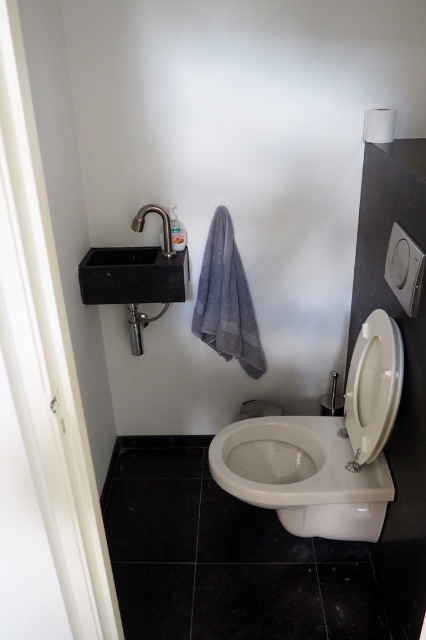
You are a bathroom designer planning to install a new 24 inch wide decorative shelf between the white glossy toilet at center and the gray matte towel bar at upper center. Based on the current spacing between them, will the shelf fit without moving either object?

The distance between the white glossy toilet at center and the gray matte towel bar at upper center is 38.46 inches. Since the shelf is only 24 inches wide, there is enough space to install it without moving either object.

You are a bathroom designer checking the bathroom layout. You need to ensure that the smaller object between the white plastic toilet lid at lower right and the gray matte towel bar at upper center is placed in a position that won which one is smaller?

The gray matte towel bar at upper center is smaller than the white plastic toilet lid at lower right, so the smaller object is the gray matte towel bar at upper center.